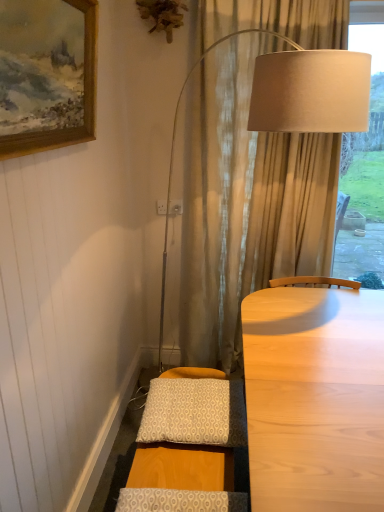
The image size is (384, 512). Identify the location of patterned fabric pillow at lower center, positioned as the first pillow in bottom-to-top order. (180, 500).

Find the location of a particular element. This screenshot has width=384, height=512. patterned fabric pillow at lower center, the second pillow ordered from the bottom is located at coordinates (188, 412).

What are the coordinates of `the 1st pillow positioned below the wooden framed painting at upper left (from a real-world perspective)` in the screenshot? It's located at (188, 412).

Considering the sizes of objects wooden framed painting at upper left and patterned fabric pillow at lower center, the 1th pillow from the back, in the image provided, who is bigger, wooden framed painting at upper left or patterned fabric pillow at lower center, the 1th pillow from the back,?

Bigger between the two is wooden framed painting at upper left.

From a real-world perspective, which object stands above the other?

In real-world perspective, wooden framed painting at upper left is above.

Does point (65, 143) lie behind point (180, 410)?

No.

You are a GUI agent. You are given a task and a screenshot of the screen. Output one action in this format:
    pyautogui.click(x=<x>, y=<y>)
    Task: Click on the 2nd pillow directly beneath the wooden framed painting at upper left (from a real-world perspective)
    The width and height of the screenshot is (384, 512).
    Given the screenshot: What is the action you would take?
    pyautogui.click(x=180, y=500)

Which object is further away from the camera, wooden framed painting at upper left or patterned fabric pillow at lower center, positioned as the first pillow in bottom-to-top order?

patterned fabric pillow at lower center, positioned as the first pillow in bottom-to-top order, is further from the camera.

Is wooden framed painting at upper left not near patterned fabric pillow at lower center, the first pillow viewed from the front?

wooden framed painting at upper left is far away from patterned fabric pillow at lower center, the first pillow viewed from the front.

From a real-world perspective, is patterned fabric pillow at lower center, the first pillow viewed from the front, above or below patterned fabric pillow at lower center, the second pillow ordered from the bottom?

patterned fabric pillow at lower center, the first pillow viewed from the front, is situated lower than patterned fabric pillow at lower center, the second pillow ordered from the bottom, in the real world.

From the image's perspective, relative to patterned fabric pillow at lower center, which ranks as the 1th pillow in top-to-bottom order, is patterned fabric pillow at lower center, positioned as the first pillow in bottom-to-top order, above or below?

patterned fabric pillow at lower center, positioned as the first pillow in bottom-to-top order, is below patterned fabric pillow at lower center, which ranks as the 1th pillow in top-to-bottom order.

Considering the positions of objects patterned fabric pillow at lower center, arranged as the second pillow when viewed from the back, and patterned fabric pillow at lower center, which ranks as the 1th pillow in top-to-bottom order, in the image provided, who is behind, patterned fabric pillow at lower center, arranged as the second pillow when viewed from the back, or patterned fabric pillow at lower center, which ranks as the 1th pillow in top-to-bottom order,?

patterned fabric pillow at lower center, which ranks as the 1th pillow in top-to-bottom order, is more distant.

Are patterned fabric pillow at lower center, positioned as the first pillow in bottom-to-top order, and patterned fabric pillow at lower center, the 1th pillow from the back, beside each other?

patterned fabric pillow at lower center, positioned as the first pillow in bottom-to-top order, and patterned fabric pillow at lower center, the 1th pillow from the back, are clearly separated.

Could you tell me if patterned fabric pillow at lower center, the second pillow ordered from the bottom, is facing patterned fabric pillow at lower center, the first pillow viewed from the front?

No, patterned fabric pillow at lower center, the second pillow ordered from the bottom, is not facing towards patterned fabric pillow at lower center, the first pillow viewed from the front.

Is patterned fabric pillow at lower center, which ranks as the 1th pillow in top-to-bottom order, in contact with patterned fabric pillow at lower center, the 2th pillow viewed from the top?

No, patterned fabric pillow at lower center, which ranks as the 1th pillow in top-to-bottom order, is not next to patterned fabric pillow at lower center, the 2th pillow viewed from the top.

Considering the positions of objects patterned fabric pillow at lower center, the second pillow in the front-to-back sequence, and patterned fabric pillow at lower center, positioned as the first pillow in bottom-to-top order, in the image provided, who is more to the right, patterned fabric pillow at lower center, the second pillow in the front-to-back sequence, or patterned fabric pillow at lower center, positioned as the first pillow in bottom-to-top order,?

From the viewer's perspective, patterned fabric pillow at lower center, the second pillow in the front-to-back sequence, appears more on the right side.

Based on their sizes in the image, would you say patterned fabric pillow at lower center, the 1th pillow from the back, is bigger or smaller than patterned fabric pillow at lower center, the 2th pillow viewed from the top?

Considering their sizes, patterned fabric pillow at lower center, the 1th pillow from the back, takes up more space than patterned fabric pillow at lower center, the 2th pillow viewed from the top.

Looking at the image, does patterned fabric pillow at lower center, arranged as the second pillow when viewed from the back, seem bigger or smaller compared to wooden framed painting at upper left?

Considering their sizes, patterned fabric pillow at lower center, arranged as the second pillow when viewed from the back, takes up less space than wooden framed painting at upper left.

Between patterned fabric pillow at lower center, the 2th pillow viewed from the top, and wooden framed painting at upper left, which one has more height?

With more height is wooden framed painting at upper left.

Does patterned fabric pillow at lower center, the 2th pillow viewed from the top, appear on the left side of wooden framed painting at upper left?

No, patterned fabric pillow at lower center, the 2th pillow viewed from the top, is not to the left of wooden framed painting at upper left.

Could you tell me if patterned fabric pillow at lower center, arranged as the second pillow when viewed from the back, is facing wooden framed painting at upper left?

No, patterned fabric pillow at lower center, arranged as the second pillow when viewed from the back, is not facing towards wooden framed painting at upper left.

From the image's perspective, which object appears higher, patterned fabric pillow at lower center, which ranks as the 1th pillow in top-to-bottom order, or wooden framed painting at upper left?

wooden framed painting at upper left is shown above in the image.

Consider the image. Can wooden framed painting at upper left be found inside patterned fabric pillow at lower center, the 1th pillow from the back?

No, wooden framed painting at upper left is not a part of patterned fabric pillow at lower center, the 1th pillow from the back.

Considering the points (191, 428) and (86, 81), which point is behind, point (191, 428) or point (86, 81)?

Positioned behind is point (86, 81).

Starting from the wooden framed painting at upper left, which pillow is the 2nd one behind? Please provide its 2D coordinates.

[(188, 412)]

Where is `pillow that is the 1st object directly below the wooden framed painting at upper left (from a real-world perspective)`? This screenshot has width=384, height=512. pillow that is the 1st object directly below the wooden framed painting at upper left (from a real-world perspective) is located at coordinates (188, 412).

Locate an element on the screen. This screenshot has width=384, height=512. picture frame that appears above the patterned fabric pillow at lower center, the 2th pillow viewed from the top (from the image's perspective) is located at coordinates coord(84,99).

Estimate the real-world distances between objects in this image. Which object is further from patterned fabric pillow at lower center, which ranks as the 1th pillow in top-to-bottom order, patterned fabric pillow at lower center, arranged as the second pillow when viewed from the back, or wooden framed painting at upper left?

Among the two, wooden framed painting at upper left is located further to patterned fabric pillow at lower center, which ranks as the 1th pillow in top-to-bottom order.

When comparing their distances from wooden framed painting at upper left, does patterned fabric pillow at lower center, positioned as the first pillow in bottom-to-top order, or patterned fabric pillow at lower center, the 1th pillow from the back, seem closer?

Among the two, patterned fabric pillow at lower center, the 1th pillow from the back, is located nearer to wooden framed painting at upper left.

Based on their spatial positions, is patterned fabric pillow at lower center, the 1th pillow from the back, or patterned fabric pillow at lower center, positioned as the first pillow in bottom-to-top order, further from wooden framed painting at upper left?

Based on the image, patterned fabric pillow at lower center, positioned as the first pillow in bottom-to-top order, appears to be further to wooden framed painting at upper left.

Considering their positions, is wooden framed painting at upper left positioned further to patterned fabric pillow at lower center, the second pillow in the front-to-back sequence, than patterned fabric pillow at lower center, arranged as the second pillow when viewed from the back?

The object further to patterned fabric pillow at lower center, the second pillow in the front-to-back sequence, is wooden framed painting at upper left.

Considering their positions, is wooden framed painting at upper left positioned closer to patterned fabric pillow at lower center, the first pillow viewed from the front, than patterned fabric pillow at lower center, which ranks as the 1th pillow in top-to-bottom order?

patterned fabric pillow at lower center, which ranks as the 1th pillow in top-to-bottom order, is positioned closer to the anchor patterned fabric pillow at lower center, the first pillow viewed from the front.

Estimate the real-world distances between objects in this image. Which object is closer to patterned fabric pillow at lower center, the first pillow viewed from the front, patterned fabric pillow at lower center, the second pillow ordered from the bottom, or wooden framed painting at upper left?

Based on the image, patterned fabric pillow at lower center, the second pillow ordered from the bottom, appears to be nearer to patterned fabric pillow at lower center, the first pillow viewed from the front.

This screenshot has height=512, width=384. I want to click on pillow between wooden framed painting at upper left and patterned fabric pillow at lower center, arranged as the second pillow when viewed from the back, in the up-down direction, so click(x=188, y=412).